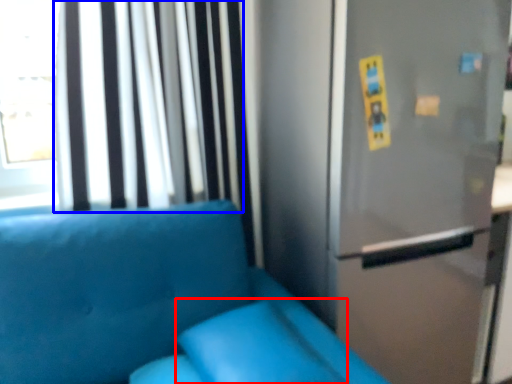
Question: Which object appears farthest to the camera in this image, pillow (highlighted by a red box) or curtain (highlighted by a blue box)?

Choices:
 (A) pillow
 (B) curtain

Answer: (B)